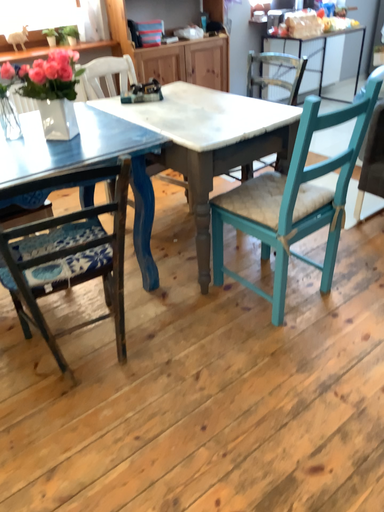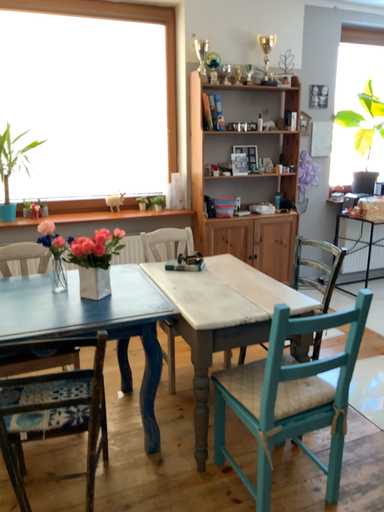
Question: Which way did the camera rotate in the video?

Choices:
 (A) rotated downward
 (B) rotated upward

Answer: (B)